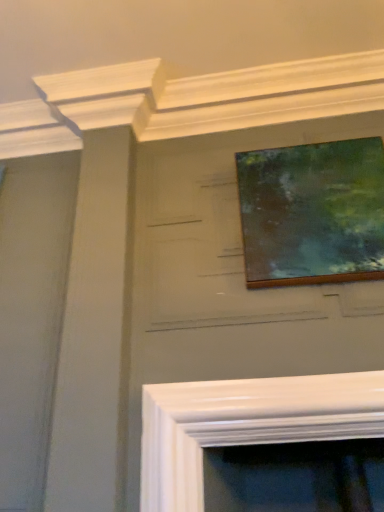
Question: Should I look upward or downward to see wooden painting frame at upper center?

Choices:
 (A) up
 (B) down

Answer: (A)